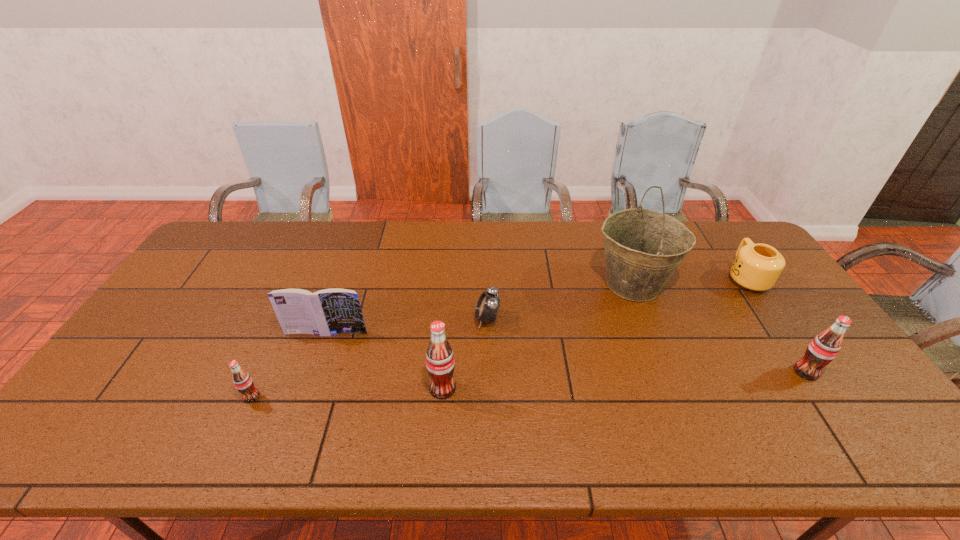
The height and width of the screenshot is (540, 960). Identify the location of soda that stands as the closest to the wine bucket. (825, 346).

Where is `free point that satisfies the following two spatial constraints: 1. on the face of the fifth shortest object; 2. on the right side of the alarm clock`? Image resolution: width=960 pixels, height=540 pixels. free point that satisfies the following two spatial constraints: 1. on the face of the fifth shortest object; 2. on the right side of the alarm clock is located at coordinates tap(488, 372).

This screenshot has width=960, height=540. I want to click on vacant area in the image that satisfies the following two spatial constraints: 1. on the front cover of the second soda from left to right; 2. on the right side of the book, so coord(307,388).

Locate an element on the screen. The width and height of the screenshot is (960, 540). free point that satisfies the following two spatial constraints: 1. on the front cover of the rightmost soda; 2. on the right side of the fourth tallest object is located at coordinates (313, 372).